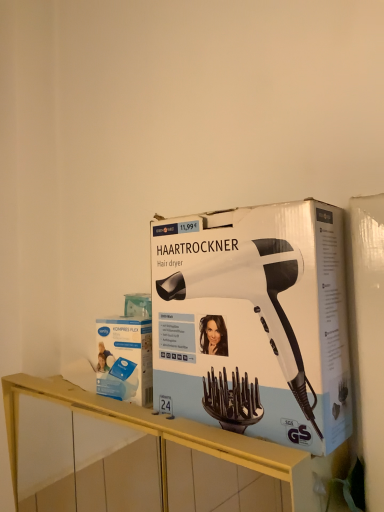
Question: Considering the relative positions of white/black plastic hair dryer at center and yellow wood shelf at center in the image provided, is white/black plastic hair dryer at center to the left or to the right of yellow wood shelf at center?

Choices:
 (A) left
 (B) right

Answer: (B)

Question: Looking at their shapes, would you say white/black plastic hair dryer at center is wider or thinner than yellow wood shelf at center?

Choices:
 (A) thin
 (B) wide

Answer: (A)

Question: Which is nearer to the white/black plastic hair dryer at center?

Choices:
 (A) yellow wood shelf at center
 (B) blue cardboard box at center

Answer: (B)

Question: Estimate the real-world distances between objects in this image. Which object is farther from the yellow wood shelf at center?

Choices:
 (A) white/black plastic hair dryer at center
 (B) blue cardboard box at center

Answer: (A)